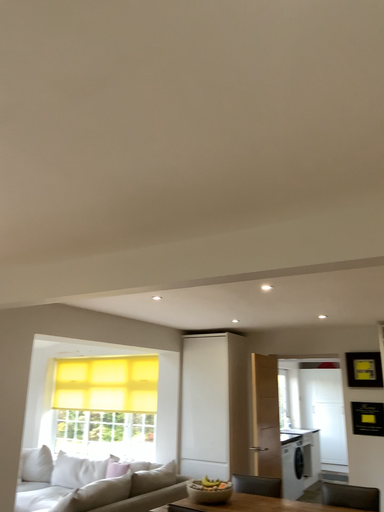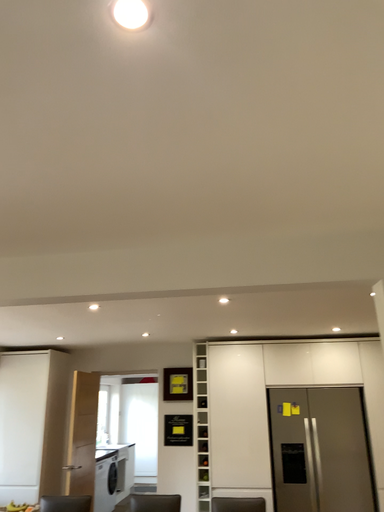
Question: How did the camera likely rotate when shooting the video?

Choices:
 (A) rotated right
 (B) rotated left

Answer: (A)